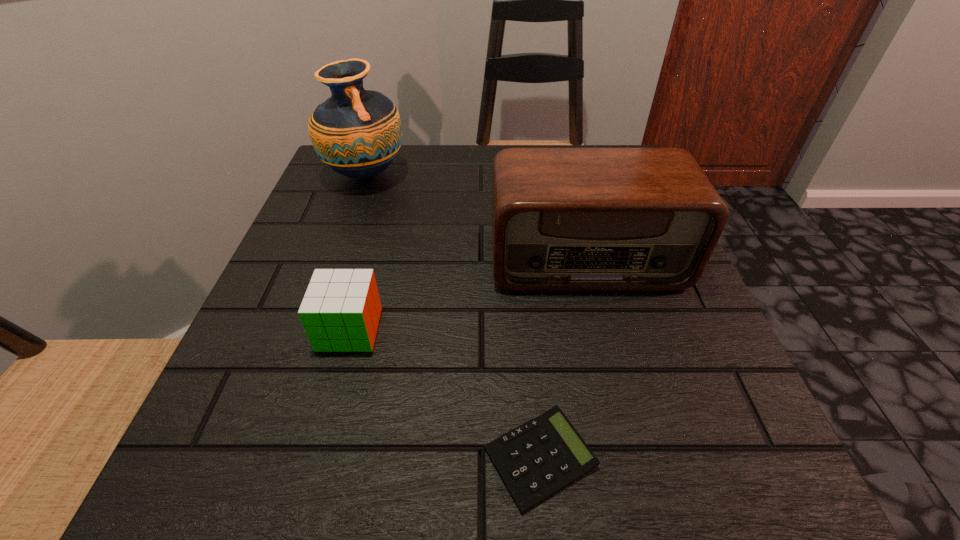
I want to click on vacant region between the nearest object and the second tallest object, so click(x=563, y=359).

Locate an element on the screen. The width and height of the screenshot is (960, 540). free area in between the third farthest object and the third shortest object is located at coordinates (468, 294).

The height and width of the screenshot is (540, 960). I want to click on vacant space that is in between the shortest object and the third farthest object, so click(x=444, y=394).

You are a GUI agent. You are given a task and a screenshot of the screen. Output one action in this format:
    pyautogui.click(x=<x>, y=<y>)
    Task: Click on the object that is the closest to the third farthest object
    The width and height of the screenshot is (960, 540).
    Given the screenshot: What is the action you would take?
    pyautogui.click(x=563, y=219)

Locate which object is the second closest to the radio receiver. Please provide its 2D coordinates. Your answer should be formatted as a tuple, i.e. [(x, y)], where the tuple contains the x and y coordinates of a point satisfying the conditions above.

[(537, 459)]

Where is `free space that satisfies the following two spatial constraints: 1. on the front side of the tallest object; 2. on the right side of the calculator`? free space that satisfies the following two spatial constraints: 1. on the front side of the tallest object; 2. on the right side of the calculator is located at coordinates (266, 458).

Identify the location of vacant space that satisfies the following two spatial constraints: 1. on the front side of the second shortest object; 2. on the right side of the nearest object. (314, 458).